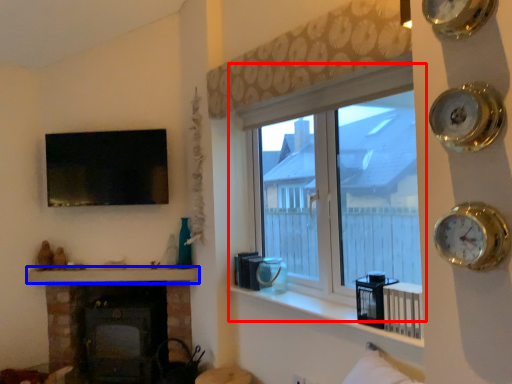
Question: Which object appears closest to the camera in this image, window (highlighted by a red box) or mantle (highlighted by a blue box)?

Choices:
 (A) window
 (B) mantle

Answer: (A)